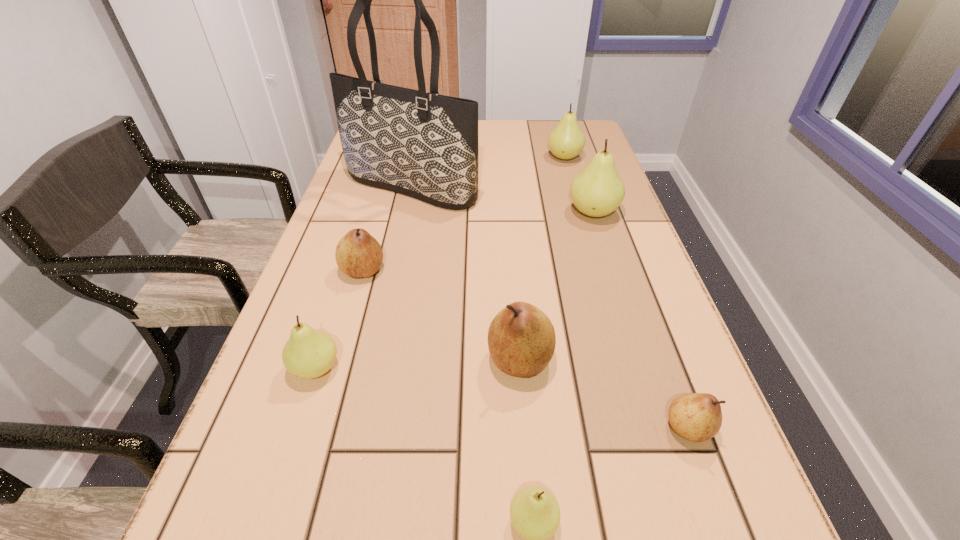
This screenshot has width=960, height=540. In order to click on green pear that is the third closest one to the nearest object in this screenshot , I will do `click(566, 140)`.

Locate an element on the screen. This screenshot has height=540, width=960. green pear that is the third closest to the biggest brown pear is located at coordinates (597, 191).

Identify which brown pear is the third nearest to the smallest green pear. Please provide its 2D coordinates. Your answer should be formatted as a tuple, i.e. [(x, y)], where the tuple contains the x and y coordinates of a point satisfying the conditions above.

[(358, 254)]

Choose which brown pear is the nearest neighbor to the leftmost brown pear. Please provide its 2D coordinates. Your answer should be formatted as a tuple, i.e. [(x, y)], where the tuple contains the x and y coordinates of a point satisfying the conditions above.

[(521, 338)]

What are the coordinates of `vacant space that satisfies the following two spatial constraints: 1. on the front side of the second smallest green pear; 2. on the right side of the nearest brown pear` in the screenshot? It's located at (297, 428).